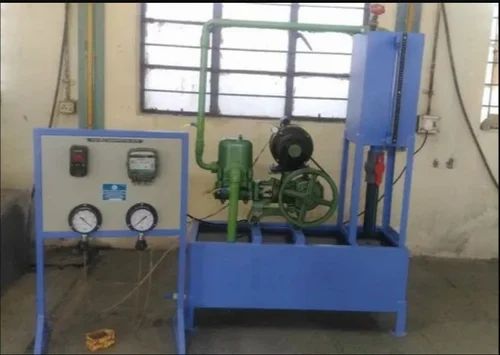
Locate an element on the screen. floor is located at coordinates (465, 277).